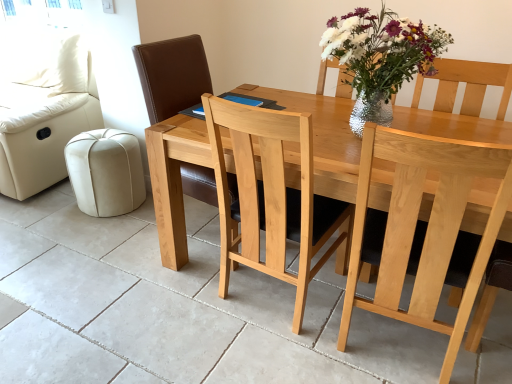
What do you see at coordinates (172, 75) in the screenshot? The width and height of the screenshot is (512, 384). I see `natural wood chair at center, the first chair positioned from the left` at bounding box center [172, 75].

The image size is (512, 384). What do you see at coordinates (423, 230) in the screenshot?
I see `light wood chair at center, which is the 1th chair from right to left` at bounding box center [423, 230].

What do you see at coordinates (174, 179) in the screenshot? I see `natural wood table at center` at bounding box center [174, 179].

The width and height of the screenshot is (512, 384). I want to click on natural wood chair at center, the first chair positioned from the left, so click(x=172, y=75).

Considering the relative sizes of beige leather ottoman at lower left and light wood chair at center, the 2th chair in the left-to-right sequence, in the image provided, is beige leather ottoman at lower left bigger than light wood chair at center, the 2th chair in the left-to-right sequence,?

No, beige leather ottoman at lower left is not bigger than light wood chair at center, the 2th chair in the left-to-right sequence.

Is beige leather ottoman at lower left facing away from light wood chair at center, the 2th chair in the left-to-right sequence?

No, beige leather ottoman at lower left is not facing away from light wood chair at center, the 2th chair in the left-to-right sequence.

From the image's perspective, would you say beige leather ottoman at lower left is shown under light wood chair at center, the 2th chair in the left-to-right sequence?

No.

Is natural wood chair at center, which appears as the second chair when viewed from the right, surrounded by natural wood table at center?

Yes, natural wood chair at center, which appears as the second chair when viewed from the right, is surrounded by natural wood table at center.

Considering the sizes of natural wood table at center and natural wood chair at center, which appears as the second chair when viewed from the right, in the image, is natural wood table at center taller or shorter than natural wood chair at center, which appears as the second chair when viewed from the right,?

In the image, natural wood table at center appears to be shorter than natural wood chair at center, which appears as the second chair when viewed from the right.

Is natural wood table at center closer to the viewer compared to natural wood chair at center, the first chair positioned from the left?

Yes, it is in front of natural wood chair at center, the first chair positioned from the left.

From a real-world perspective, is natural wood table at center physically above natural wood chair at center, the first chair positioned from the left?

No, from a real-world perspective, natural wood table at center is not over natural wood chair at center, the first chair positioned from the left

What's the angular difference between light wood chair at center, which is the 1th chair from right to left, and beige leather ottoman at lower left's facing directions?

They differ by 179 degrees in their facing directions.

From the image's perspective, is light wood chair at center, which is the 1th chair from right to left, above or below beige leather ottoman at lower left?

Clearly, from the image's perspective, light wood chair at center, which is the 1th chair from right to left, is below beige leather ottoman at lower left.

The height and width of the screenshot is (384, 512). I want to click on stool above the light wood chair at center, which is the 1th chair from right to left (from the image's perspective), so point(106,172).

From a real-world perspective, does light wood chair at center, which is the 1th chair from right to left, sit lower than beige leather ottoman at lower left?

No.

From the image's perspective, between light wood chair at center, which is the 1th chair from right to left, and natural wood table at center, who is located below?

From the image's view, light wood chair at center, which is the 1th chair from right to left, is below.

Considering the sizes of objects light wood chair at center, the 2th chair in the left-to-right sequence, and natural wood table at center in the image provided, who is taller, light wood chair at center, the 2th chair in the left-to-right sequence, or natural wood table at center?

With more height is light wood chair at center, the 2th chair in the left-to-right sequence.

Between light wood chair at center, which is the 1th chair from right to left, and natural wood table at center, which one has smaller size?

With smaller size is light wood chair at center, which is the 1th chair from right to left.

Does point (473, 175) appear closer or farther from the camera than point (183, 246)?

Clearly, point (473, 175) is closer to the camera than point (183, 246).

Which object is wider, cream leather couch at left or natural wood table at center?

cream leather couch at left is wider.

Which is in front, point (20, 54) or point (414, 289)?

Positioned in front is point (414, 289).

From a real-world perspective, is cream leather couch at left beneath natural wood table at center?

Incorrect, from a real-world perspective, cream leather couch at left is higher than natural wood table at center.

Does natural wood table at center have a greater width compared to beige leather ottoman at lower left?

Indeed, natural wood table at center has a greater width compared to beige leather ottoman at lower left.

Is natural wood table at center bigger than beige leather ottoman at lower left?

Correct, natural wood table at center is larger in size than beige leather ottoman at lower left.

Considering the sizes of objects cream leather couch at left and natural wood chair at center, the first chair positioned from the left, in the image provided, who is thinner, cream leather couch at left or natural wood chair at center, the first chair positioned from the left,?

natural wood chair at center, the first chair positioned from the left.

How distant is cream leather couch at left from natural wood chair at center, which appears as the second chair when viewed from the right?

They are 3.61 feet apart.

Who is smaller, cream leather couch at left or natural wood chair at center, the first chair positioned from the left?

Smaller between the two is natural wood chair at center, the first chair positioned from the left.

Which of these two, cream leather couch at left or natural wood chair at center, the first chair positioned from the left, stands shorter?

Standing shorter between the two is cream leather couch at left.

At what (x,y) coordinates should I click in order to perform the action: click on chair below the beige leather ottoman at lower left (from the image's perspective). Please return your answer as a coordinate pair (x, y). Image resolution: width=512 pixels, height=384 pixels. Looking at the image, I should click on (423, 230).

I want to click on the 2nd chair directly above the natural wood table at center (from a real-world perspective), so click(x=172, y=75).

When comparing their distances from light wood chair at center, the 2th chair in the left-to-right sequence, does natural wood table at center or beige leather ottoman at lower left seem closer?

Among the two, natural wood table at center is located nearer to light wood chair at center, the 2th chair in the left-to-right sequence.

Which object lies further to the anchor point natural wood table at center, light wood chair at center, the 2th chair in the left-to-right sequence, or beige leather ottoman at lower left?

beige leather ottoman at lower left is further to natural wood table at center.

Looking at the image, which one is located further to natural wood chair at center, which appears as the second chair when viewed from the right, cream leather couch at left or beige leather ottoman at lower left?

The object further to natural wood chair at center, which appears as the second chair when viewed from the right, is cream leather couch at left.

In the scene shown: Looking at the image, which one is located closer to cream leather couch at left, natural wood table at center or natural wood chair at center, which appears as the second chair when viewed from the right?

Among the two, natural wood chair at center, which appears as the second chair when viewed from the right, is located nearer to cream leather couch at left.

Which object lies nearer to the anchor point natural wood chair at center, which appears as the second chair when viewed from the right, natural wood table at center or light wood chair at center, the 2th chair in the left-to-right sequence?

natural wood table at center is positioned closer to the anchor natural wood chair at center, which appears as the second chair when viewed from the right.

From the image, which object appears to be nearer to natural wood chair at center, the first chair positioned from the left, beige leather ottoman at lower left or cream leather couch at left?

The object closer to natural wood chair at center, the first chair positioned from the left, is beige leather ottoman at lower left.

Looking at this image, estimate the real-world distances between objects in this image. Which object is closer to cream leather couch at left, natural wood chair at center, the first chair positioned from the left, or light wood chair at center, the 2th chair in the left-to-right sequence?

natural wood chair at center, the first chair positioned from the left.

Estimate the real-world distances between objects in this image. Which object is further from natural wood chair at center, which appears as the second chair when viewed from the right, beige leather ottoman at lower left or natural wood table at center?

Among the two, beige leather ottoman at lower left is located further to natural wood chair at center, which appears as the second chair when viewed from the right.

Image resolution: width=512 pixels, height=384 pixels. What are the coordinates of `table between natural wood chair at center, the first chair positioned from the left, and light wood chair at center, which is the 1th chair from right to left, in the horizontal direction` in the screenshot? It's located at (174, 179).

The height and width of the screenshot is (384, 512). I want to click on stool between cream leather couch at left and natural wood table at center in the horizontal direction, so click(106, 172).

This screenshot has width=512, height=384. Find the location of `table between beige leather ottoman at lower left and light wood chair at center, the 2th chair in the left-to-right sequence, in the horizontal direction`. table between beige leather ottoman at lower left and light wood chair at center, the 2th chair in the left-to-right sequence, in the horizontal direction is located at coordinates (174, 179).

Find the location of a particular element. This screenshot has height=384, width=512. chair situated between cream leather couch at left and natural wood table at center from left to right is located at coordinates (172, 75).